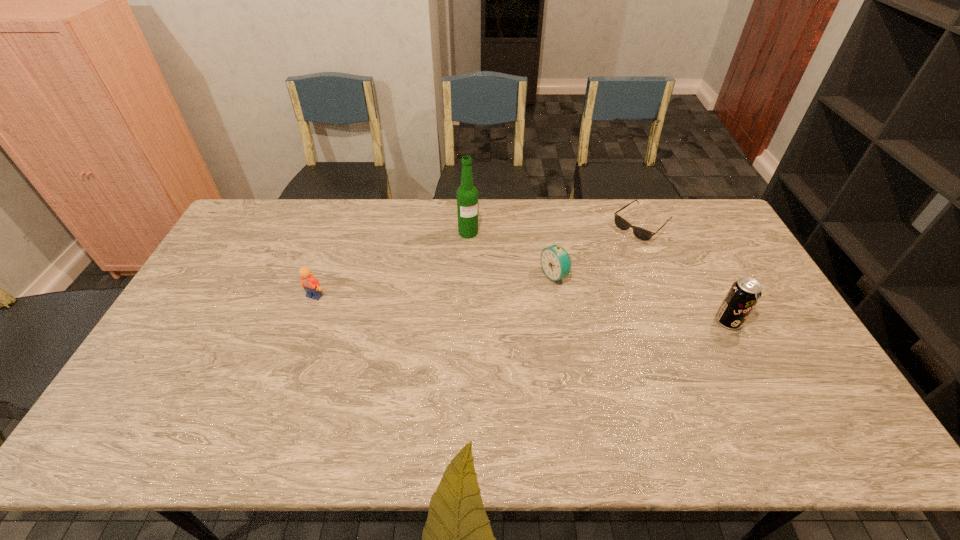
I want to click on vacant space that's between the fourth farthest object and the third farthest object, so click(435, 286).

The width and height of the screenshot is (960, 540). Find the location of `free spot between the leftmost object and the tallest object`. free spot between the leftmost object and the tallest object is located at coordinates (392, 264).

Where is `vacant point located between the third object from left to right and the soda can`? This screenshot has width=960, height=540. vacant point located between the third object from left to right and the soda can is located at coordinates (641, 299).

Locate an element on the screen. free point between the second nearest object and the third farthest object is located at coordinates (435, 286).

Locate an element on the screen. The image size is (960, 540). free space between the second tallest object and the beer bottle is located at coordinates (598, 277).

Where is `vacant area that lies between the leftmost object and the third object from left to right`? The width and height of the screenshot is (960, 540). vacant area that lies between the leftmost object and the third object from left to right is located at coordinates (435, 286).

The height and width of the screenshot is (540, 960). Identify the location of vacant space in between the third object from left to right and the second tallest object. (641, 299).

The width and height of the screenshot is (960, 540). I want to click on vacant area between the third nearest object and the second nearest object, so tap(435, 286).

Locate an element on the screen. This screenshot has height=540, width=960. free spot between the second object from left to right and the soda can is located at coordinates (598, 277).

Locate which object is the third closest to the sunglasses. Please provide its 2D coordinates. Your answer should be formatted as a tuple, i.e. [(x, y)], where the tuple contains the x and y coordinates of a point satisfying the conditions above.

[(467, 194)]